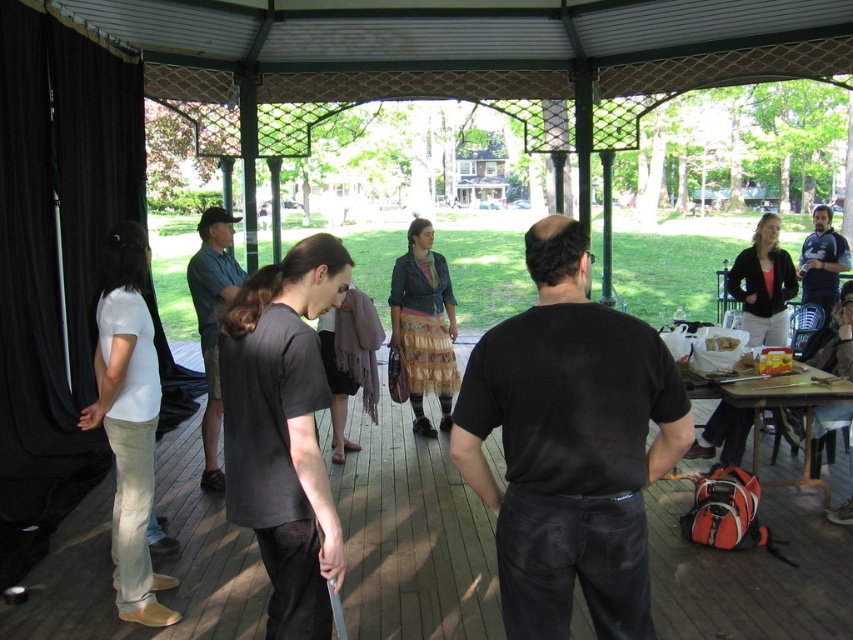
Can you confirm if wooden picnic table at lower right is positioned to the left of blue denim shirt at right?

Correct, you'll find wooden picnic table at lower right to the left of blue denim shirt at right.

Identify the location of wooden picnic table at lower right. The width and height of the screenshot is (853, 640). (786, 406).

In the scene shown: Which of these two, black matte shirt at center or blue denim shorts at center, stands shorter?

black matte shirt at center is shorter.

Can you confirm if black matte shirt at center is positioned to the left of blue denim shorts at center?

In fact, black matte shirt at center is to the right of blue denim shorts at center.

Where is `black matte shirt at center`? black matte shirt at center is located at coordinates (570, 445).

Is blue denim shorts at center smaller than wooden picnic table at lower right?

No.

Is blue denim shorts at center closer to camera compared to wooden picnic table at lower right?

Yes, it is in front of wooden picnic table at lower right.

Is point (207, 444) positioned in front of point (802, 484)?

No, it is not.

You are a GUI agent. You are given a task and a screenshot of the screen. Output one action in this format:
    pyautogui.click(x=<x>, y=<y>)
    Task: Click on the blue denim shorts at center
    
    Given the screenshot: What is the action you would take?
    pyautogui.click(x=212, y=321)